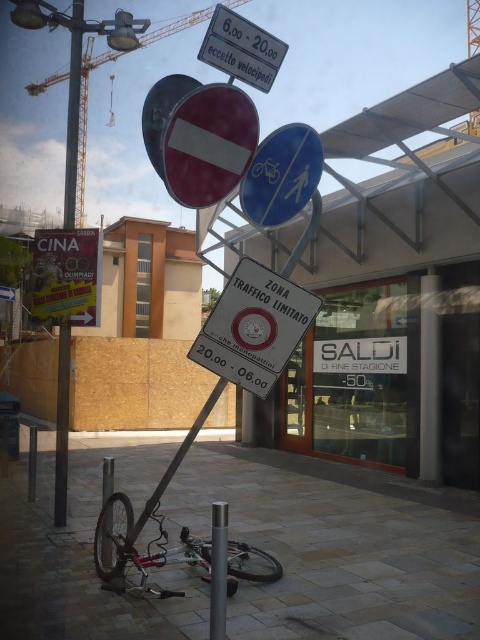
Can you confirm if paved stone pavement at center is thinner than brushed metal crane at upper left?

Result: Yes.

Can you confirm if paved stone pavement at center is positioned below brushed metal crane at upper left?

Yes.

Between point (432, 524) and point (158, 32), which one is positioned behind?

Positioned behind is point (158, 32).

The width and height of the screenshot is (480, 640). I want to click on paved stone pavement at center, so click(335, 554).

Who is positioned more to the right, metallic silver sign at center or white plastic sign at upper center?

Positioned to the right is metallic silver sign at center.

Is metallic silver sign at center above white plastic sign at upper center?

No, metallic silver sign at center is not above white plastic sign at upper center.

You are a GUI agent. You are given a task and a screenshot of the screen. Output one action in this format:
    pyautogui.click(x=<x>, y=<y>)
    Task: Click on the metallic silver sign at center
    This screenshot has width=480, height=640.
    Given the screenshot: What is the action you would take?
    pyautogui.click(x=253, y=326)

Is yellow paper poster at center below metallic pole at left?

Indeed, yellow paper poster at center is positioned under metallic pole at left.

You are a GUI agent. You are given a task and a screenshot of the screen. Output one action in this format:
    pyautogui.click(x=<x>, y=<y>)
    Task: Click on the yellow paper poster at center
    Image resolution: width=480 pixels, height=640 pixels.
    Given the screenshot: What is the action you would take?
    pyautogui.click(x=66, y=276)